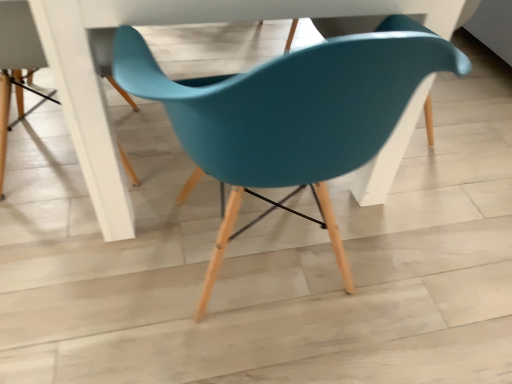
What are the coordinates of `vacant space underneath teal plastic chair at center, the first chair in the right-to-left sequence (from a real-world perspective)` in the screenshot? It's located at point(269,269).